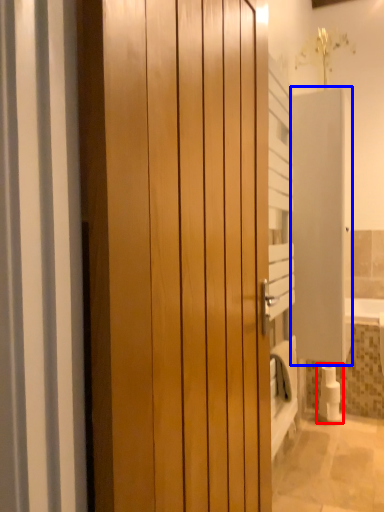
Question: Which of the following is the closest to the observer, toilet paper (highlighted by a red box) or screen door (highlighted by a blue box)?

Choices:
 (A) toilet paper
 (B) screen door

Answer: (B)